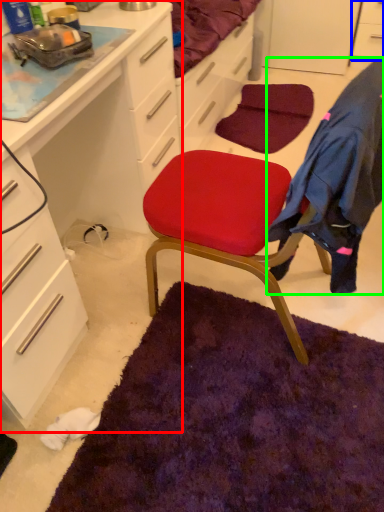
Question: Which object is the closest to the cabinetry (highlighted by a red box)? Choose among these: cabinetry (highlighted by a blue box) or clothing (highlighted by a green box).

Choices:
 (A) cabinetry
 (B) clothing

Answer: (B)